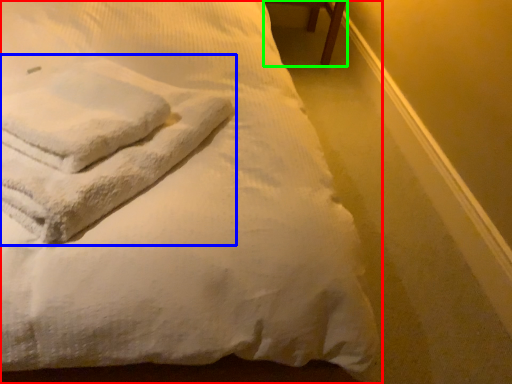
Question: Which object is positioned farthest from bed (highlighted by a red box)? Select from bath towel (highlighted by a blue box) and furniture (highlighted by a green box).

Choices:
 (A) bath towel
 (B) furniture

Answer: (B)